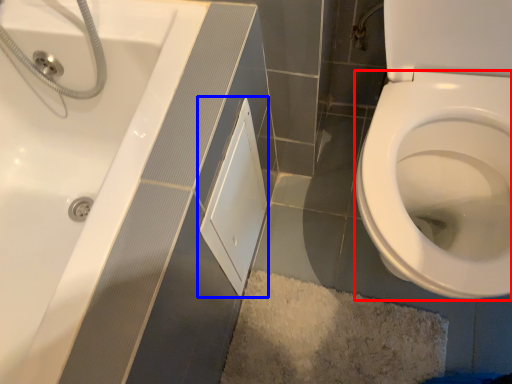
Question: Among these objects, which one is farthest to the camera, bidet (highlighted by a red box) or screen door (highlighted by a blue box)?

Choices:
 (A) bidet
 (B) screen door

Answer: (B)